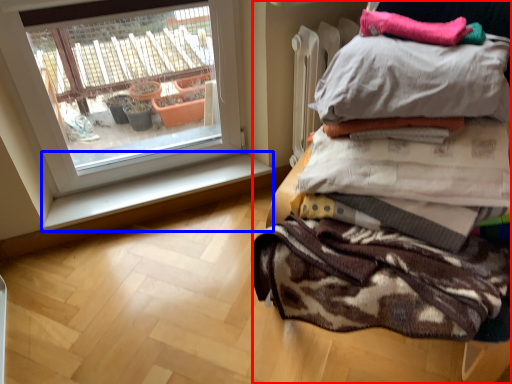
Question: Which object is further to the camera taking this photo, furniture (highlighted by a red box) or window sill (highlighted by a blue box)?

Choices:
 (A) furniture
 (B) window sill

Answer: (B)